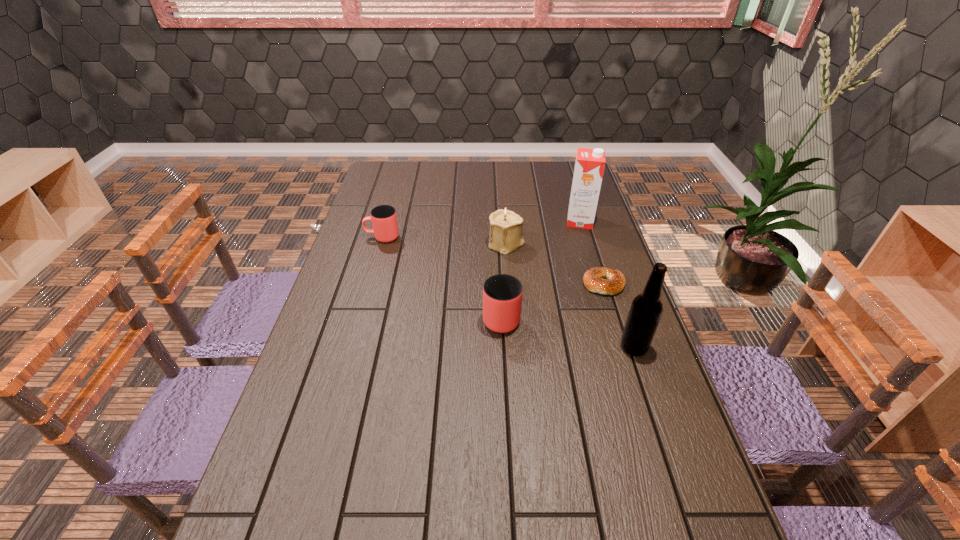
Image resolution: width=960 pixels, height=540 pixels. I want to click on vacant space at the far edge, so click(532, 161).

Find the location of a particular element. vacant region at the near edge of the desktop is located at coordinates (620, 493).

The width and height of the screenshot is (960, 540). Identify the location of free spot at the left edge of the desktop. click(366, 198).

Locate an element on the screen. free space at the right edge is located at coordinates (686, 431).

Find the location of `free space at the far right corner of the desktop`. free space at the far right corner of the desktop is located at coordinates (569, 163).

Locate an element on the screen. free space between the bagel and the candle_holder is located at coordinates coord(555,264).

The height and width of the screenshot is (540, 960). I want to click on free space that is in between the shortest object and the leftmost object, so click(493, 261).

The height and width of the screenshot is (540, 960). Identify the location of free spot between the farther cup and the carton. (481, 229).

At what (x,y) coordinates should I click in order to perform the action: click on vacant region between the bagel and the candle_holder. Please return your answer as a coordinate pair (x, y). Looking at the image, I should click on (555, 264).

The width and height of the screenshot is (960, 540). Identify the location of vacant area between the candle_holder and the second shortest object. (444, 241).